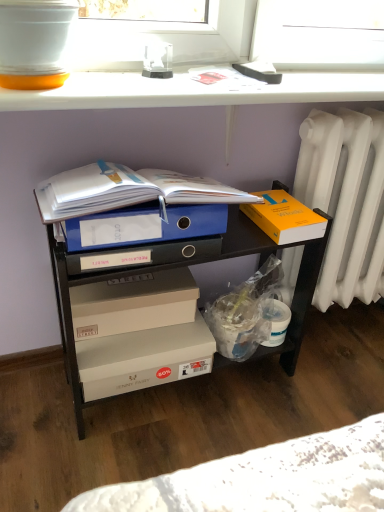
Question: From the image's perspective, is beige cardboard box at center, the second box from the top, over white plastic radiator at right?

Choices:
 (A) yes
 (B) no

Answer: (B)

Question: Is white plastic radiator at right at the back of beige cardboard box at center, the second box from the top?

Choices:
 (A) no
 (B) yes

Answer: (A)

Question: Is the depth of beige cardboard box at center, the second box from the top, greater than that of white plastic radiator at right?

Choices:
 (A) yes
 (B) no

Answer: (A)

Question: Is beige cardboard box at center, positioned as the 2th box in bottom-to-top order, bigger than white plastic radiator at right?

Choices:
 (A) no
 (B) yes

Answer: (A)

Question: Is beige cardboard box at center, the second box from the top, not near white plastic radiator at right?

Choices:
 (A) no
 (B) yes

Answer: (A)

Question: Looking at their shapes, would you say beige cardboard box at center, positioned as the 2th box in bottom-to-top order, is wider or thinner than white glossy window sill at upper center?

Choices:
 (A) wide
 (B) thin

Answer: (B)

Question: In the image, is beige cardboard box at center, the second box from the top, positioned in front of or behind white glossy window sill at upper center?

Choices:
 (A) behind
 (B) front

Answer: (A)

Question: Considering the positions of beige cardboard box at center, positioned as the 2th box in bottom-to-top order, and white glossy window sill at upper center in the image, is beige cardboard box at center, positioned as the 2th box in bottom-to-top order, taller or shorter than white glossy window sill at upper center?

Choices:
 (A) tall
 (B) short

Answer: (A)

Question: Is point (87, 318) positioned closer to the camera than point (175, 93)?

Choices:
 (A) farther
 (B) closer

Answer: (A)

Question: In terms of height, does white plastic radiator at right look taller or shorter compared to blue plastic file at center?

Choices:
 (A) tall
 (B) short

Answer: (A)

Question: Is point (360, 245) closer or farther from the camera than point (6, 274)?

Choices:
 (A) farther
 (B) closer

Answer: (A)

Question: Is white plastic radiator at right wider or thinner than blue plastic file at center?

Choices:
 (A) wide
 (B) thin

Answer: (B)

Question: Is white plastic radiator at right situated inside blue plastic file at center or outside?

Choices:
 (A) outside
 (B) inside

Answer: (A)

Question: From a real-world perspective, is blue plastic file at center positioned above or below white glossy window sill at upper center?

Choices:
 (A) above
 (B) below

Answer: (B)

Question: Is blue plastic file at center in front of or behind white glossy window sill at upper center in the image?

Choices:
 (A) behind
 (B) front

Answer: (A)